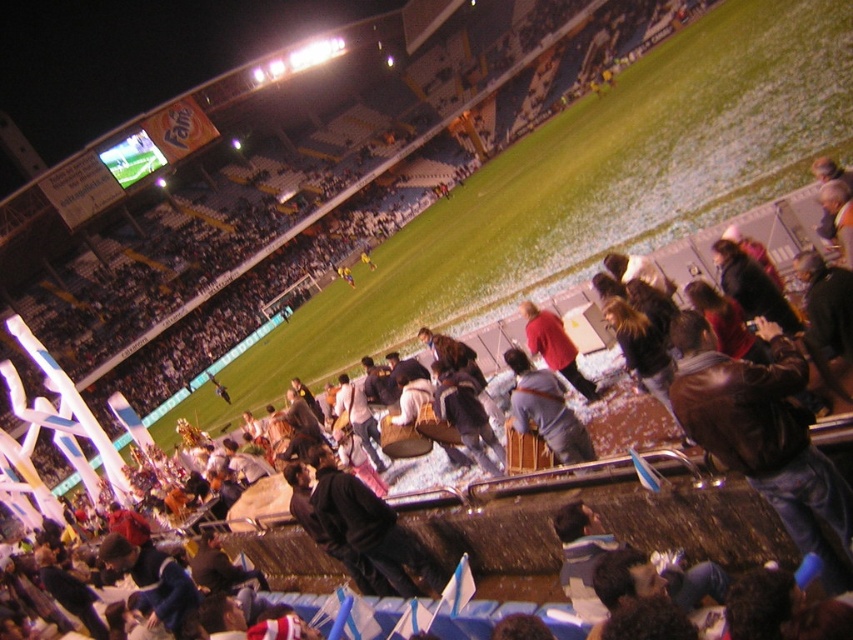
Is gray fabric jacket at center closer to camera compared to red matte jacket at center?

Yes, gray fabric jacket at center is in front of red matte jacket at center.

Can you confirm if gray fabric jacket at center is bigger than red matte jacket at center?

Actually, gray fabric jacket at center might be smaller than red matte jacket at center.

You are a GUI agent. You are given a task and a screenshot of the screen. Output one action in this format:
    pyautogui.click(x=<x>, y=<y>)
    Task: Click on the gray fabric jacket at center
    
    Given the screenshot: What is the action you would take?
    pyautogui.click(x=546, y=410)

What are the coordinates of `gray fabric jacket at center` in the screenshot? It's located at (546, 410).